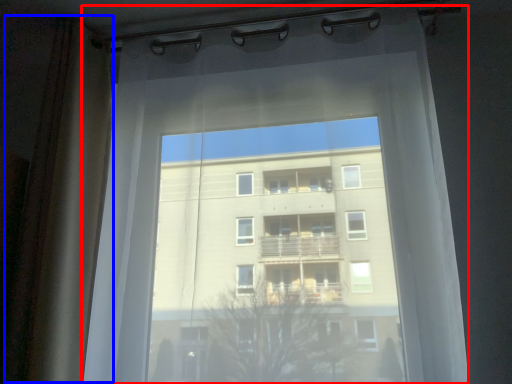
Question: Which point is further to the camera, curtain (highlighted by a red box) or shower curtain (highlighted by a blue box)?

Choices:
 (A) curtain
 (B) shower curtain

Answer: (B)